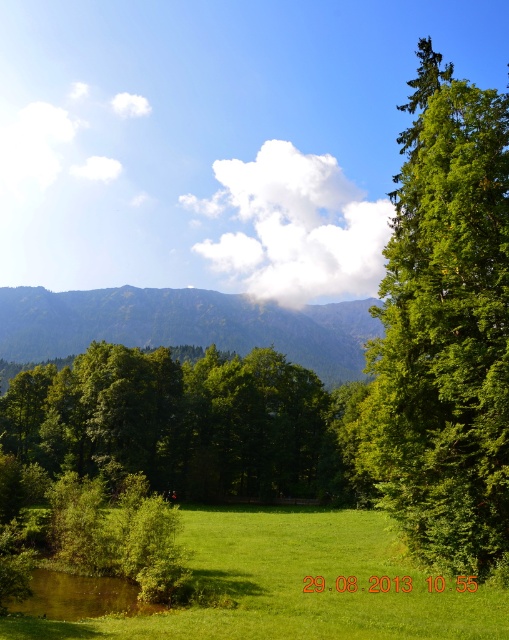
Based on the photo, which is below, green leafy tree at right or green grassy field at lower center?

green grassy field at lower center is below.

Who is higher up, green leafy tree at right or green grassy field at lower center?

green leafy tree at right is higher up.

The width and height of the screenshot is (509, 640). What are the coordinates of `green leafy tree at right` in the screenshot? It's located at (444, 330).

Can you confirm if green grassy field at lower center is wider than green forested mountain at center?

Incorrect, green grassy field at lower center's width does not surpass green forested mountain at center's.

Between point (365, 580) and point (46, 310), which one is positioned in front?

Point (365, 580)

The height and width of the screenshot is (640, 509). I want to click on green grassy field at lower center, so click(x=296, y=586).

Is green leafy tree at right positioned in front of green forested mountain at center?

Yes, green leafy tree at right is closer to the viewer.

Locate an element on the screen. Image resolution: width=509 pixels, height=640 pixels. green leafy tree at right is located at coordinates (444, 330).